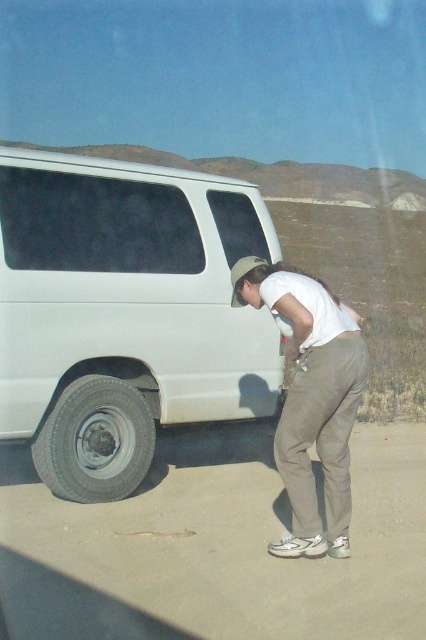
Question: Is white matte van at left in front of white cotton shirt at center?

Choices:
 (A) yes
 (B) no

Answer: (B)

Question: Which point is closer to the camera?

Choices:
 (A) white cotton shirt at center
 (B) gray rubber tire at lower left
 (C) white matte van at left

Answer: (A)

Question: Where is white cotton shirt at center located in relation to gray rubber tire at lower left in the image?

Choices:
 (A) right
 (B) left

Answer: (A)

Question: Which point is farther to the camera?

Choices:
 (A) white cotton shirt at center
 (B) gray rubber tire at lower left
 (C) white matte van at left

Answer: (B)

Question: Does white matte van at left have a larger size compared to gray rubber tire at lower left?

Choices:
 (A) no
 (B) yes

Answer: (B)

Question: Estimate the real-world distances between objects in this image. Which object is closer to the white matte van at left?

Choices:
 (A) gray rubber tire at lower left
 (B) white cotton shirt at center

Answer: (A)